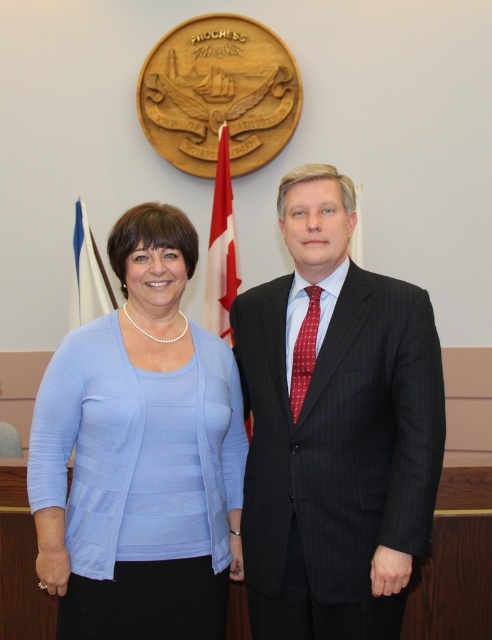
Question: Where is dark pinstripe suit at center located in relation to light blue fabric shirt at center in the image?

Choices:
 (A) above
 (B) below

Answer: (A)

Question: Considering the relative positions of dark pinstripe suit at center and light blue fabric shirt at center in the image provided, where is dark pinstripe suit at center located with respect to light blue fabric shirt at center?

Choices:
 (A) right
 (B) left

Answer: (A)

Question: Is dark pinstripe suit at center thinner than blue fabric flag at left?

Choices:
 (A) no
 (B) yes

Answer: (A)

Question: Which point is closer to the camera?

Choices:
 (A) pos(340,509)
 (B) pos(147,483)

Answer: (A)

Question: Which point is farther from the camera taking this photo?

Choices:
 (A) (94, 420)
 (B) (431, 416)

Answer: (A)

Question: Among these points, which one is nearest to the camera?

Choices:
 (A) [78, 236]
 (B) [117, 352]
 (C) [309, 321]

Answer: (B)